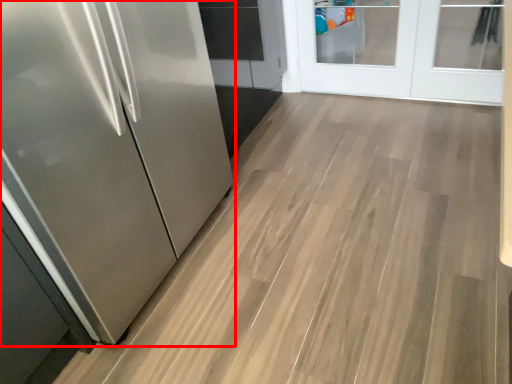
Question: From the image's perspective, what is the correct spatial positioning of refrigerator (annotated by the red box) in reference to door?

Choices:
 (A) below
 (B) above

Answer: (A)